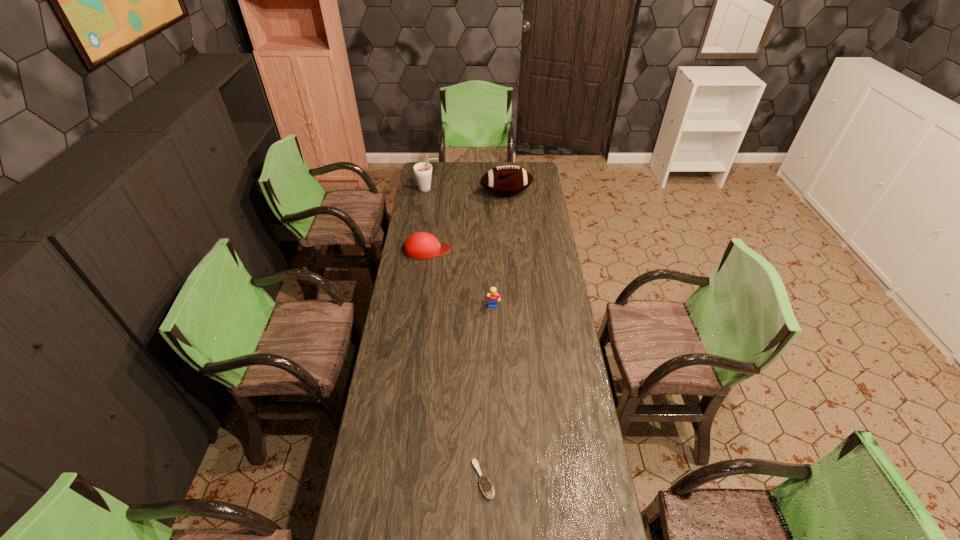
Identify the location of free location that satisfies the following two spatial constraints: 1. on the back side of the shortest object; 2. on the front-facing side of the baseball cap. Image resolution: width=960 pixels, height=540 pixels. (482, 249).

At what (x,y) coordinates should I click in order to perform the action: click on free point that satisfies the following two spatial constraints: 1. on the drink side of the root beer; 2. on the back side of the nearest object. Please return your answer as a coordinate pair (x, y). The width and height of the screenshot is (960, 540). Looking at the image, I should click on (383, 480).

The image size is (960, 540). In order to click on vacant area in the image that satisfies the following two spatial constraints: 1. on the back side of the football (American); 2. on the drink side of the root beer in this screenshot , I will do `click(506, 190)`.

Locate an element on the screen. This screenshot has width=960, height=540. free space that satisfies the following two spatial constraints: 1. on the front-facing side of the fourth tallest object; 2. on the right side of the scrubbing brush is located at coordinates (398, 480).

This screenshot has width=960, height=540. I want to click on vacant region that satisfies the following two spatial constraints: 1. on the drink side of the scrubbing brush; 2. on the right side of the root beer, so click(x=383, y=480).